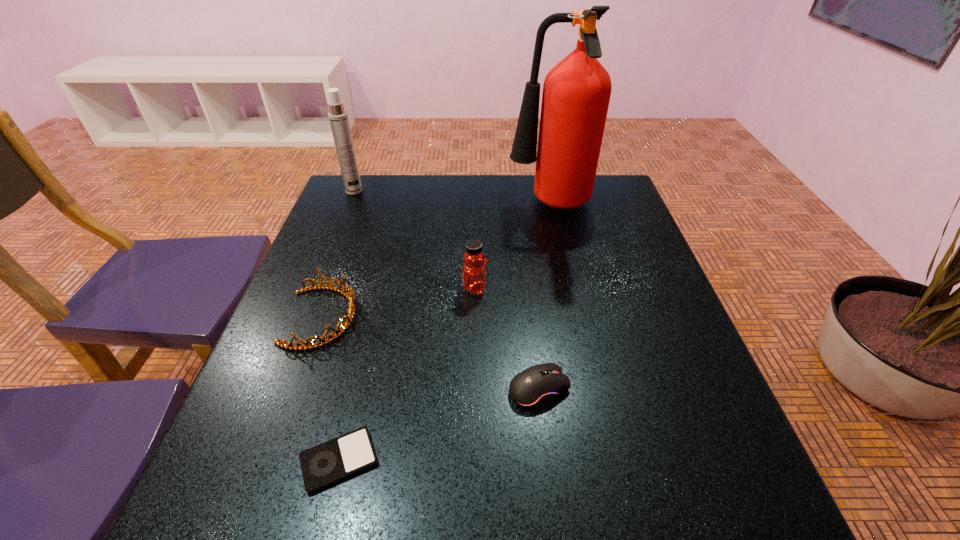
Where is `free space at the near right corner of the desktop`? The height and width of the screenshot is (540, 960). free space at the near right corner of the desktop is located at coordinates (748, 502).

The width and height of the screenshot is (960, 540). What are the coordinates of `vacant area that lies between the shortest object and the third tallest object` in the screenshot? It's located at (407, 374).

Image resolution: width=960 pixels, height=540 pixels. What are the coordinates of `free spot between the tiara and the second nearest object` in the screenshot? It's located at (431, 353).

At what (x,y) coordinates should I click in order to perform the action: click on vacant space in between the aerosol can and the third tallest object. Please return your answer as a coordinate pair (x, y). This screenshot has width=960, height=540. Looking at the image, I should click on (415, 240).

The height and width of the screenshot is (540, 960). What are the coordinates of `vacant space that is in between the computer mouse and the third tallest object` in the screenshot? It's located at (507, 339).

Locate an element on the screen. vacant area that lies between the fourth tallest object and the tallest object is located at coordinates (436, 262).

The height and width of the screenshot is (540, 960). I want to click on vacant area that lies between the computer mouse and the fire extinguisher, so click(x=544, y=298).

You are a GUI agent. You are given a task and a screenshot of the screen. Output one action in this format:
    pyautogui.click(x=<x>, y=<y>)
    Task: Click on the vacant area that lies between the third object from right to left and the aerosol can
    The height and width of the screenshot is (540, 960).
    Given the screenshot: What is the action you would take?
    pyautogui.click(x=415, y=240)

Where is `free spot between the third object from right to left and the second shortest object`? Image resolution: width=960 pixels, height=540 pixels. free spot between the third object from right to left and the second shortest object is located at coordinates (507, 339).

Locate an element on the screen. This screenshot has height=540, width=960. blank region between the honey and the fifth shortest object is located at coordinates click(415, 240).